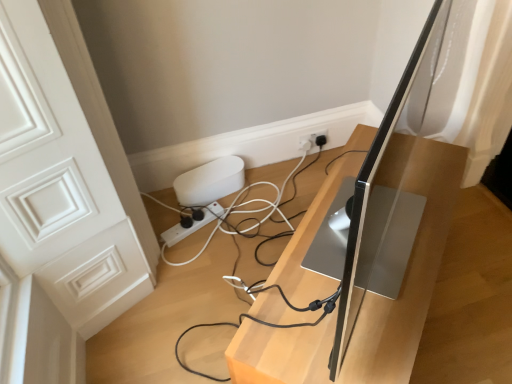
Question: Can you confirm if silver metallic monitor at center is positioned to the left of silver metallic computer monitor at center?

Choices:
 (A) yes
 (B) no

Answer: (A)

Question: Considering the relative sizes of silver metallic monitor at center and silver metallic computer monitor at center in the image provided, is silver metallic monitor at center taller than silver metallic computer monitor at center?

Choices:
 (A) yes
 (B) no

Answer: (B)

Question: Could you tell me if silver metallic monitor at center is turned towards silver metallic computer monitor at center?

Choices:
 (A) no
 (B) yes

Answer: (A)

Question: Are silver metallic monitor at center and silver metallic computer monitor at center far apart?

Choices:
 (A) yes
 (B) no

Answer: (B)

Question: Is silver metallic monitor at center turned away from silver metallic computer monitor at center?

Choices:
 (A) no
 (B) yes

Answer: (A)

Question: From a real-world perspective, is silver metallic monitor at center physically located above or below silver metallic computer monitor at center?

Choices:
 (A) below
 (B) above

Answer: (A)

Question: Choose the correct answer: Is silver metallic monitor at center inside silver metallic computer monitor at center or outside it?

Choices:
 (A) inside
 (B) outside

Answer: (B)

Question: Would you say silver metallic monitor at center is to the left or to the right of silver metallic computer monitor at center in the picture?

Choices:
 (A) right
 (B) left

Answer: (B)

Question: From the image's perspective, is silver metallic monitor at center located above or below silver metallic computer monitor at center?

Choices:
 (A) below
 (B) above

Answer: (A)

Question: In terms of size, does white plastic power strip at lower center appear bigger or smaller than silver metallic monitor at center?

Choices:
 (A) small
 (B) big

Answer: (A)

Question: Is white plastic power strip at lower center taller or shorter than silver metallic monitor at center?

Choices:
 (A) tall
 (B) short

Answer: (B)

Question: From a real-world perspective, relative to silver metallic monitor at center, is white plastic power strip at lower center vertically above or below?

Choices:
 (A) below
 (B) above

Answer: (A)

Question: Looking at their shapes, would you say white plastic power strip at lower center is wider or thinner than silver metallic monitor at center?

Choices:
 (A) thin
 (B) wide

Answer: (A)

Question: Is silver metallic computer monitor at center bigger or smaller than white plastic power strip at lower center?

Choices:
 (A) big
 (B) small

Answer: (A)

Question: Is point (346, 342) positioned closer to the camera than point (215, 208)?

Choices:
 (A) farther
 (B) closer

Answer: (B)